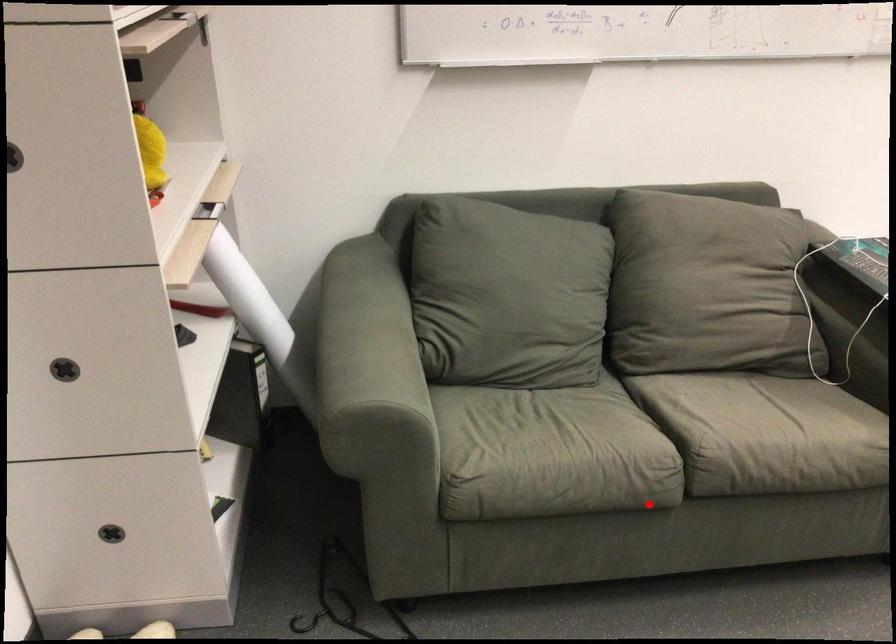
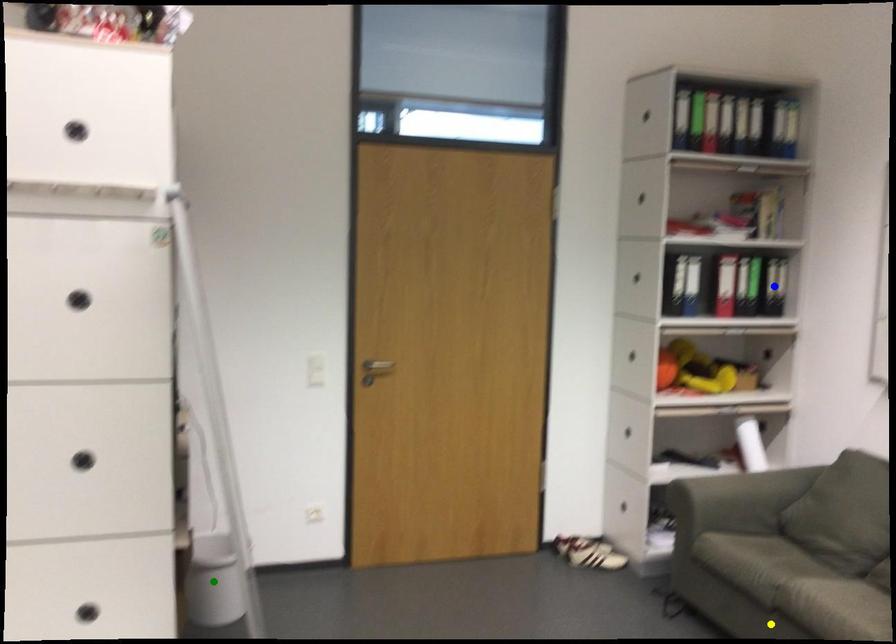
Question: I am providing you with two images of the same scene from different viewpoints. A red point is marked on the first image. You are given multiple points on the second image. In image 2, which mark is for the same physical point as the one in image 1?

Choices:
 (A) blue point
 (B) yellow point
 (C) green point

Answer: (B)